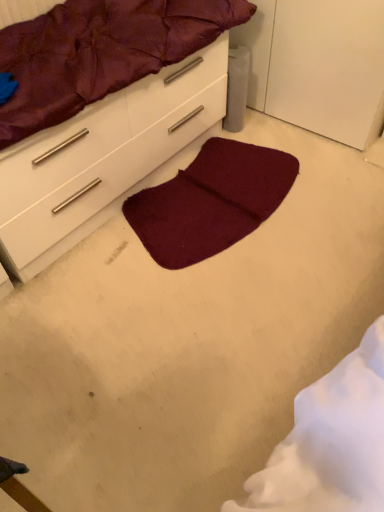
Question: From the image's perspective, is matte white chest of drawers at center located above or below burgundy fabric mattress at upper center?

Choices:
 (A) above
 (B) below

Answer: (B)

Question: Is matte white chest of drawers at center in front of or behind burgundy fabric mattress at upper center in the image?

Choices:
 (A) behind
 (B) front

Answer: (A)

Question: Which is nearer to the matte white chest of drawers at center?

Choices:
 (A) burgundy fabric mattress at upper center
 (B) burgundy plush mat at center

Answer: (A)

Question: Based on their relative distances, which object is nearer to the burgundy plush mat at center?

Choices:
 (A) matte white chest of drawers at center
 (B) burgundy fabric mattress at upper center

Answer: (A)